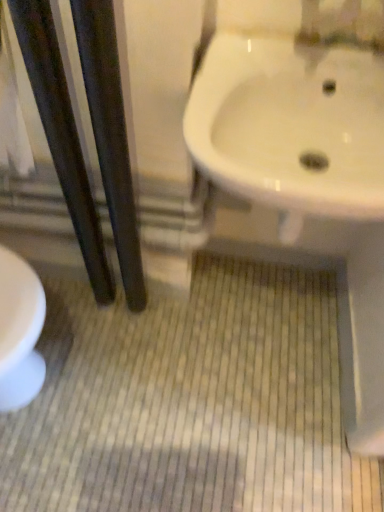
What do you see at coordinates (110, 135) in the screenshot? This screenshot has height=512, width=384. I see `black glossy poles at left, which appears as the second pole when viewed from the left` at bounding box center [110, 135].

At what (x,y) coordinates should I click in order to perform the action: click on white glossy sink at upper right. Please return your answer as a coordinate pair (x, y). The height and width of the screenshot is (512, 384). Looking at the image, I should click on [290, 108].

Considering the relative sizes of dark wood pole at left, acting as the second pole starting from the right, and black glossy poles at left, the 1th pole viewed from the right, in the image provided, is dark wood pole at left, acting as the second pole starting from the right, smaller than black glossy poles at left, the 1th pole viewed from the right,?

Yes.

Is point (72, 169) closer to camera compared to point (91, 52)?

No.

Where is `pole located above the dark wood pole at left, acting as the second pole starting from the right (from a real-world perspective)`? The width and height of the screenshot is (384, 512). pole located above the dark wood pole at left, acting as the second pole starting from the right (from a real-world perspective) is located at coordinates (110, 135).

Does dark wood pole at left, acting as the second pole starting from the right, have a greater width compared to black glossy poles at left, the 1th pole viewed from the right?

Incorrect, the width of dark wood pole at left, acting as the second pole starting from the right, does not surpass that of black glossy poles at left, the 1th pole viewed from the right.

In terms of height, does white glossy sink at upper right look taller or shorter compared to black glossy poles at left, the 1th pole viewed from the right?

white glossy sink at upper right is shorter than black glossy poles at left, the 1th pole viewed from the right.

Does white glossy sink at upper right turn towards black glossy poles at left, the 1th pole viewed from the right?

No.

From a real-world perspective, between white glossy sink at upper right and black glossy poles at left, which appears as the second pole when viewed from the left, who is vertically higher?

In real-world perspective, white glossy sink at upper right is above.

Would you say black glossy poles at left, which appears as the second pole when viewed from the left, is part of white glossy sink at upper right's contents?

No, white glossy sink at upper right does not contain black glossy poles at left, which appears as the second pole when viewed from the left.

Does white glossy sink at upper right have a lesser height compared to dark wood pole at left, marked as the first pole in a left-to-right arrangement?

Yes, white glossy sink at upper right is shorter than dark wood pole at left, marked as the first pole in a left-to-right arrangement.

What's the angular difference between white glossy sink at upper right and dark wood pole at left, marked as the first pole in a left-to-right arrangement,'s facing directions?

The angular difference between white glossy sink at upper right and dark wood pole at left, marked as the first pole in a left-to-right arrangement, is 0.852 degrees.

In the scene shown: Considering the sizes of objects white glossy sink at upper right and dark wood pole at left, marked as the first pole in a left-to-right arrangement, in the image provided, who is wider, white glossy sink at upper right or dark wood pole at left, marked as the first pole in a left-to-right arrangement,?

white glossy sink at upper right.

From a real-world perspective, who is located lower, white glossy sink at upper right or dark wood pole at left, marked as the first pole in a left-to-right arrangement?

From a 3D spatial view, dark wood pole at left, marked as the first pole in a left-to-right arrangement, is below.

Looking at this image, is black glossy poles at left, which appears as the second pole when viewed from the left, positioned beyond the bounds of white glossy sink at upper right?

Yes, black glossy poles at left, which appears as the second pole when viewed from the left, is outside of white glossy sink at upper right.

This screenshot has width=384, height=512. In order to click on pole that is the 2nd object located below the white glossy sink at upper right (from the image's perspective) in this screenshot , I will do `click(110, 135)`.

From a real-world perspective, between black glossy poles at left, which appears as the second pole when viewed from the left, and white glossy sink at upper right, who is vertically higher?

white glossy sink at upper right, from a real-world perspective.

From the image's perspective, is black glossy poles at left, the 1th pole viewed from the right, on white glossy sink at upper right?

Incorrect, from the image's perspective, black glossy poles at left, the 1th pole viewed from the right, is lower than white glossy sink at upper right.

Which object is wider, black glossy poles at left, which appears as the second pole when viewed from the left, or dark wood pole at left, marked as the first pole in a left-to-right arrangement?

black glossy poles at left, which appears as the second pole when viewed from the left.

Is black glossy poles at left, the 1th pole viewed from the right, aimed at dark wood pole at left, acting as the second pole starting from the right?

No, black glossy poles at left, the 1th pole viewed from the right, is not facing towards dark wood pole at left, acting as the second pole starting from the right.

Does point (108, 74) come closer to viewer compared to point (84, 170)?

Yes, point (108, 74) is in front of point (84, 170).

In the image, there is a black glossy poles at left, which appears as the second pole when viewed from the left. Where is `pole above it (from the image's perspective)`? This screenshot has height=512, width=384. pole above it (from the image's perspective) is located at coordinates tap(62, 134).

Is the position of dark wood pole at left, acting as the second pole starting from the right, more distant than that of white glossy sink at upper right?

No.

Is point (98, 233) positioned in front of point (240, 161)?

No, (98, 233) is behind (240, 161).

Can you tell me how much dark wood pole at left, marked as the first pole in a left-to-right arrangement, and white glossy sink at upper right differ in facing direction?

The angular difference between dark wood pole at left, marked as the first pole in a left-to-right arrangement, and white glossy sink at upper right is 0.852 degrees.

Image resolution: width=384 pixels, height=512 pixels. Find the location of `pole that appears above the black glossy poles at left, the 1th pole viewed from the right (from the image's perspective)`. pole that appears above the black glossy poles at left, the 1th pole viewed from the right (from the image's perspective) is located at coordinates (62, 134).

From a real-world perspective, count 1st poles downward from the white glossy sink at upper right and point to it. Please provide its 2D coordinates.

[(110, 135)]

Looking at the image, which one is located closer to black glossy poles at left, which appears as the second pole when viewed from the left, white glossy sink at upper right or dark wood pole at left, acting as the second pole starting from the right?

dark wood pole at left, acting as the second pole starting from the right, lies closer to black glossy poles at left, which appears as the second pole when viewed from the left, than the other object.

From the image, which object appears to be nearer to white glossy sink at upper right, black glossy poles at left, which appears as the second pole when viewed from the left, or dark wood pole at left, marked as the first pole in a left-to-right arrangement?

black glossy poles at left, which appears as the second pole when viewed from the left.

Based on their spatial positions, is dark wood pole at left, marked as the first pole in a left-to-right arrangement, or white glossy sink at upper right further from black glossy poles at left, the 1th pole viewed from the right?

Based on the image, white glossy sink at upper right appears to be further to black glossy poles at left, the 1th pole viewed from the right.

When comparing their distances from white glossy sink at upper right, does dark wood pole at left, acting as the second pole starting from the right, or black glossy poles at left, which appears as the second pole when viewed from the left, seem closer?

Based on the image, black glossy poles at left, which appears as the second pole when viewed from the left, appears to be nearer to white glossy sink at upper right.

Based on their spatial positions, is black glossy poles at left, the 1th pole viewed from the right, or white glossy sink at upper right further from dark wood pole at left, acting as the second pole starting from the right?

white glossy sink at upper right lies further to dark wood pole at left, acting as the second pole starting from the right, than the other object.

Looking at the image, which one is located closer to dark wood pole at left, acting as the second pole starting from the right, white glossy sink at upper right or black glossy poles at left, which appears as the second pole when viewed from the left?

black glossy poles at left, which appears as the second pole when viewed from the left, is closer to dark wood pole at left, acting as the second pole starting from the right.

Find the location of a particular element. The image size is (384, 512). pole located between dark wood pole at left, acting as the second pole starting from the right, and white glossy sink at upper right in the left-right direction is located at coordinates (110, 135).